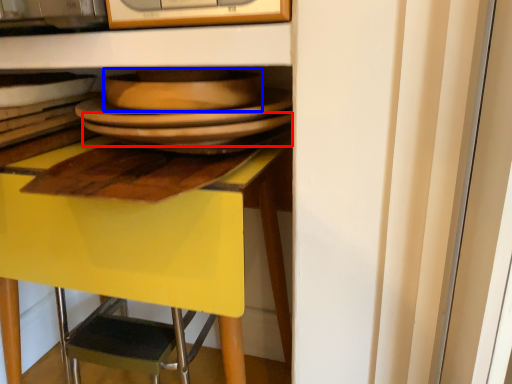
Question: Which point is further to the camera, plate (highlighted by a red box) or platter (highlighted by a blue box)?

Choices:
 (A) plate
 (B) platter

Answer: (A)